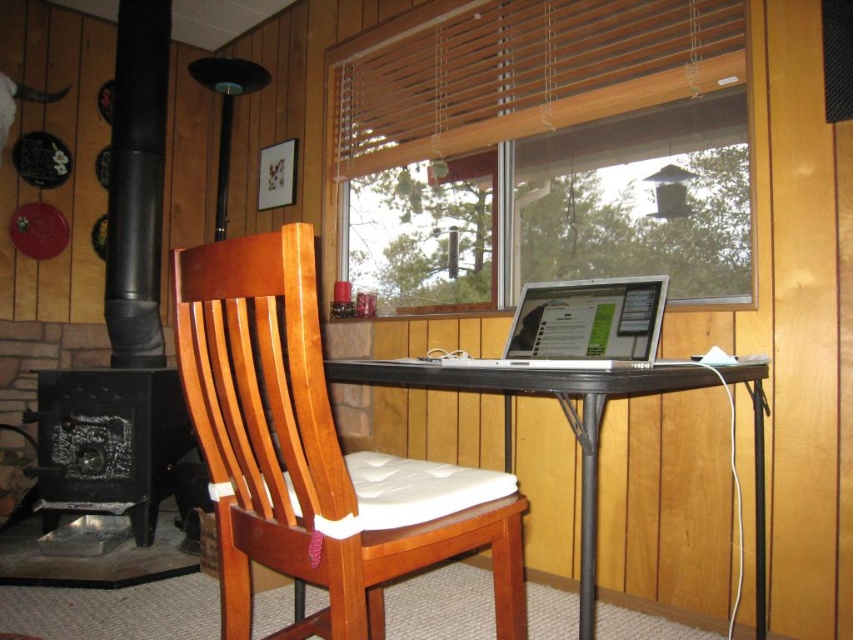
Question: Which of the following is the closest to the observer?

Choices:
 (A) [566, 417]
 (B) [102, 483]
 (C) [508, 634]

Answer: (C)

Question: Can you confirm if black cast iron fireplace at lower left is positioned below silver metallic laptop at center?

Choices:
 (A) yes
 (B) no

Answer: (A)

Question: Can you confirm if wooden blinds at upper center is positioned to the left of black metal table at center?

Choices:
 (A) no
 (B) yes

Answer: (B)

Question: Is wooden chair with white cushion at center smaller than black cast iron fireplace at lower left?

Choices:
 (A) no
 (B) yes

Answer: (A)

Question: Which object is closer to the camera taking this photo?

Choices:
 (A) wooden blinds at upper center
 (B) black cast iron fireplace at lower left
 (C) wooden chair with white cushion at center

Answer: (C)

Question: Which point is closer to the camera?

Choices:
 (A) black cast iron fireplace at lower left
 (B) wooden chair with white cushion at center
 (C) silver metallic laptop at center
 (D) black metal table at center

Answer: (B)